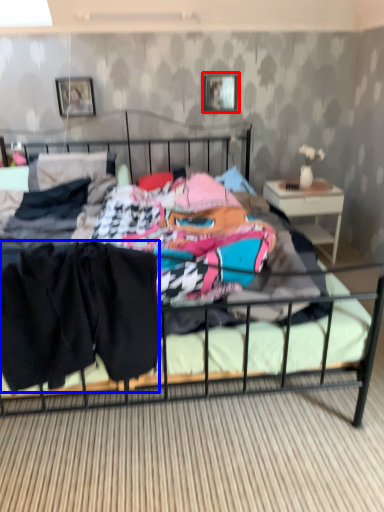
Question: Among these objects, which one is farthest to the camera, picture frame (highlighted by a red box) or clothing (highlighted by a blue box)?

Choices:
 (A) picture frame
 (B) clothing

Answer: (A)